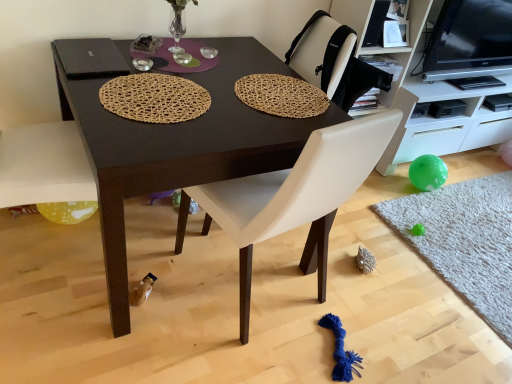
Describe the element at coordinates (281, 96) in the screenshot. This screenshot has width=512, height=384. I see `woven natural mat at upper center, acting as the third mat starting from the bottom` at that location.

Where is `woven natural mat at upper center, acting as the second mat starting from the front`? woven natural mat at upper center, acting as the second mat starting from the front is located at coordinates pyautogui.click(x=281, y=96).

You are a GUI agent. You are given a task and a screenshot of the screen. Output one action in this format:
    pyautogui.click(x=<x>, y=<y>)
    Task: Click on the white glossy cabinet at right
    
    Given the screenshot: What is the action you would take?
    pyautogui.click(x=443, y=122)

Locate an element on the screen. The width and height of the screenshot is (512, 384). translucent yellow balloon at lower left is located at coordinates (68, 211).

Image resolution: width=512 pixels, height=384 pixels. Describe the element at coordinates (464, 241) in the screenshot. I see `gray shaggy rug at lower right, the third mat from the left` at that location.

Image resolution: width=512 pixels, height=384 pixels. What do you see at coordinates (172, 140) in the screenshot? I see `dark brown wood table at center` at bounding box center [172, 140].

Find the location of a particular element. This screenshot has width=512, height=384. woven natural mat at upper center, arranged as the 2th mat when viewed from the left is located at coordinates (281, 96).

Does point (120, 92) come farther from viewer compared to point (313, 112)?

No, it is in front of (313, 112).

Is woven natural mat at center, which is the 2th mat in bottom-to-top order, oriented towards woven natural mat at upper center, acting as the third mat starting from the bottom?

No, woven natural mat at center, which is the 2th mat in bottom-to-top order, is not oriented towards woven natural mat at upper center, acting as the third mat starting from the bottom.

From the image's perspective, between woven natural mat at center, which is counted as the first mat, starting from the left, and woven natural mat at upper center, arranged as the 2th mat when viewed from the left, who is located below?

woven natural mat at center, which is counted as the first mat, starting from the left.

Looking at this image, from a real-world perspective, is woven natural mat at center, the 3th mat from the right, on top of woven natural mat at upper center, arranged as the 2th mat when viewed from the left?

Incorrect, from a real-world perspective, woven natural mat at center, the 3th mat from the right, is lower than woven natural mat at upper center, arranged as the 2th mat when viewed from the left.

From the image's perspective, count 1st mats upward from the translucent yellow balloon at lower left and point to it. Please provide its 2D coordinates.

[(154, 98)]

Is translucent yellow balloon at lower left looking in the opposite direction of woven natural mat at center, acting as the 3th mat starting from the back?

No, translucent yellow balloon at lower left is not facing the opposite direction of woven natural mat at center, acting as the 3th mat starting from the back.

From a real-world perspective, is translucent yellow balloon at lower left positioned under woven natural mat at center, acting as the 3th mat starting from the back, based on gravity?

Correct, in the physical world, translucent yellow balloon at lower left is lower than woven natural mat at center, acting as the 3th mat starting from the back.

From the image's perspective, which one is positioned higher, translucent yellow balloon at lower left or woven natural mat at center, acting as the 3th mat starting from the back?

woven natural mat at center, acting as the 3th mat starting from the back, is shown above in the image.

What's the angular difference between woven natural mat at center, arranged as the first mat when viewed from the front, and white glossy cabinet at right's facing directions?

The facing directions of woven natural mat at center, arranged as the first mat when viewed from the front, and white glossy cabinet at right are 1.63 degrees apart.

From the image's perspective, which one is positioned lower, woven natural mat at center, acting as the 3th mat starting from the back, or white glossy cabinet at right?

woven natural mat at center, acting as the 3th mat starting from the back.

Considering the sizes of objects woven natural mat at center, the 3th mat from the right, and white glossy cabinet at right in the image provided, who is wider, woven natural mat at center, the 3th mat from the right, or white glossy cabinet at right?

With larger width is white glossy cabinet at right.

From their relative heights in the image, would you say woven natural mat at center, acting as the 3th mat starting from the back, is taller or shorter than white glossy cabinet at right?

woven natural mat at center, acting as the 3th mat starting from the back, is shorter than white glossy cabinet at right.

Does gray shaggy rug at lower right, which is counted as the 1th mat, starting from the back, turn towards black glossy tv at upper right?

No, gray shaggy rug at lower right, which is counted as the 1th mat, starting from the back, is not oriented towards black glossy tv at upper right.

Considering the relative sizes of gray shaggy rug at lower right, positioned as the third mat in front-to-back order, and black glossy tv at upper right in the image provided, is gray shaggy rug at lower right, positioned as the third mat in front-to-back order, bigger than black glossy tv at upper right?

Actually, gray shaggy rug at lower right, positioned as the third mat in front-to-back order, might be smaller than black glossy tv at upper right.

Does point (506, 233) come behind point (454, 60)?

No, it is not.

Is white glossy cabinet at right oriented away from black glossy tv at upper right?

No, white glossy cabinet at right is not facing away from black glossy tv at upper right.

Considering the relative positions of white glossy cabinet at right and black glossy tv at upper right in the image provided, is white glossy cabinet at right behind black glossy tv at upper right?

Yes.

Who is bigger, white glossy cabinet at right or black glossy tv at upper right?

white glossy cabinet at right is bigger.

Is dark brown wood table at center far from woven natural mat at upper center, acting as the second mat starting from the front?

They are positioned close to each other.

Measure the distance from dark brown wood table at center to woven natural mat at upper center, the 1th mat when ordered from top to bottom.

dark brown wood table at center is 9.95 inches away from woven natural mat at upper center, the 1th mat when ordered from top to bottom.

Which object is closer to the camera taking this photo, dark brown wood table at center or woven natural mat at upper center, the second mat when ordered from back to front?

Positioned in front is dark brown wood table at center.

Which of these two, dark brown wood table at center or woven natural mat at upper center, acting as the second mat starting from the front, stands taller?

dark brown wood table at center.

Is woven natural mat at upper center, the second mat when ordered from back to front, a part of gray shaggy rug at lower right, acting as the 3th mat starting from the top?

That's incorrect, woven natural mat at upper center, the second mat when ordered from back to front, is not inside gray shaggy rug at lower right, acting as the 3th mat starting from the top.

Between gray shaggy rug at lower right, which appears as the first mat when ordered from the bottom, and woven natural mat at upper center, the 1th mat when ordered from top to bottom, which one is positioned in front?

woven natural mat at upper center, the 1th mat when ordered from top to bottom, is closer to the camera.

Is gray shaggy rug at lower right, which appears as the first mat when ordered from the bottom, wider than woven natural mat at upper center, acting as the second mat starting from the front?

Yes, gray shaggy rug at lower right, which appears as the first mat when ordered from the bottom, is wider than woven natural mat at upper center, acting as the second mat starting from the front.

Between gray shaggy rug at lower right, the third mat from the left, and woven natural mat at upper center, arranged as the 2th mat when viewed from the left, which one has less height?

woven natural mat at upper center, arranged as the 2th mat when viewed from the left, is shorter.

Identify the location of mat that is the 1st object located below the woven natural mat at upper center, acting as the third mat starting from the bottom (from the image's perspective). This screenshot has width=512, height=384. (154, 98).

From a real-world perspective, which mat is the 1st one above the translucent yellow balloon at lower left? Please provide its 2D coordinates.

[(154, 98)]

Based on their spatial positions, is translucent yellow balloon at lower left or dark brown wood table at center closer to gray shaggy rug at lower right, which appears as the 1th mat when viewed from the right?

Based on the image, dark brown wood table at center appears to be nearer to gray shaggy rug at lower right, which appears as the 1th mat when viewed from the right.

From the image, which object appears to be farther from translucent yellow balloon at lower left, dark brown wood table at center or woven natural mat at upper center, arranged as the 2th mat when viewed from the left?

The object further to translucent yellow balloon at lower left is woven natural mat at upper center, arranged as the 2th mat when viewed from the left.

Looking at the image, which one is located further to woven natural mat at center, which is the 2th mat in bottom-to-top order, woven natural mat at upper center, which is the second mat in right-to-left order, or dark brown wood table at center?

woven natural mat at upper center, which is the second mat in right-to-left order, lies further to woven natural mat at center, which is the 2th mat in bottom-to-top order, than the other object.

Estimate the real-world distances between objects in this image. Which object is further from woven natural mat at upper center, acting as the second mat starting from the front, dark brown wood table at center or translucent yellow balloon at lower left?

Based on the image, translucent yellow balloon at lower left appears to be further to woven natural mat at upper center, acting as the second mat starting from the front.

Based on their spatial positions, is translucent yellow balloon at lower left or gray shaggy rug at lower right, which appears as the 1th mat when viewed from the right, further from woven natural mat at upper center, arranged as the 2th mat when viewed from the left?

gray shaggy rug at lower right, which appears as the 1th mat when viewed from the right.

When comparing their distances from woven natural mat at upper center, the second mat when ordered from back to front, does black glossy tv at upper right or dark brown wood table at center seem further?

Based on the image, black glossy tv at upper right appears to be further to woven natural mat at upper center, the second mat when ordered from back to front.

Consider the image. Based on their spatial positions, is white leather chair at center or woven natural mat at center, which is the 2th mat in bottom-to-top order, further from white glossy cabinet at right?

woven natural mat at center, which is the 2th mat in bottom-to-top order.

Looking at the image, which one is located further to translucent yellow balloon at lower left, dark brown wood table at center or gray shaggy rug at lower right, positioned as the third mat in front-to-back order?

gray shaggy rug at lower right, positioned as the third mat in front-to-back order, is positioned further to the anchor translucent yellow balloon at lower left.

Image resolution: width=512 pixels, height=384 pixels. I want to click on table between white leather chair at center and woven natural mat at upper center, acting as the third mat starting from the bottom, along the z-axis, so click(172, 140).

The width and height of the screenshot is (512, 384). I want to click on television situated between translucent yellow balloon at lower left and gray shaggy rug at lower right, which is counted as the 1th mat, starting from the back, from left to right, so click(470, 40).

The width and height of the screenshot is (512, 384). I want to click on mat between white leather chair at center and black glossy tv at upper right, so click(281, 96).

Image resolution: width=512 pixels, height=384 pixels. Identify the location of chair between translucent yellow balloon at lower left and gray shaggy rug at lower right, which appears as the 1th mat when viewed from the right, in the horizontal direction. (293, 197).